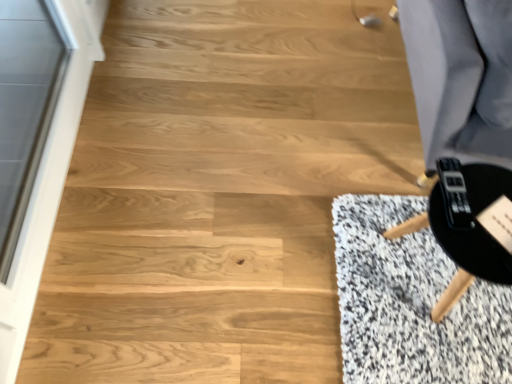
This screenshot has height=384, width=512. I want to click on vacant space underneath transparent glass screen door at left (from a real-world perspective), so click(x=70, y=177).